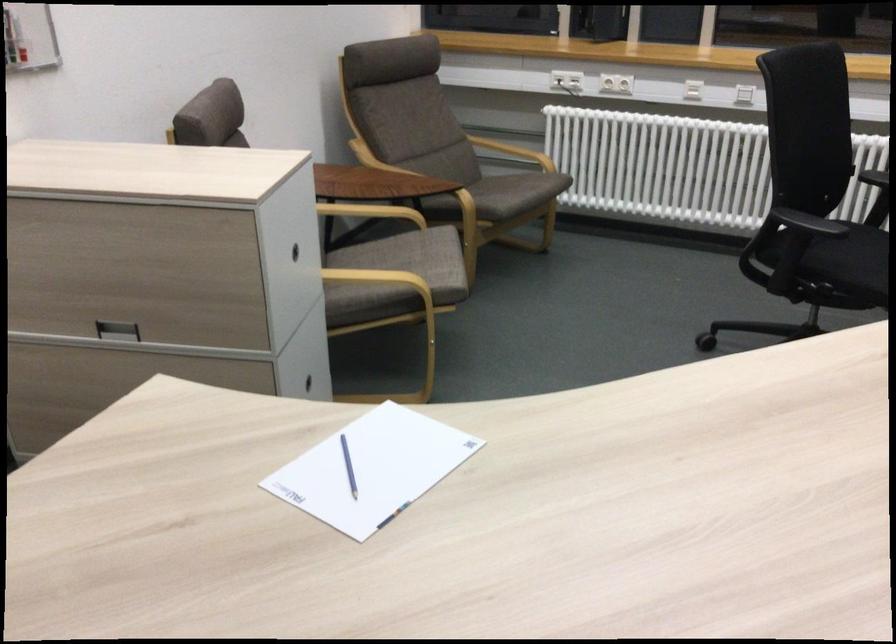
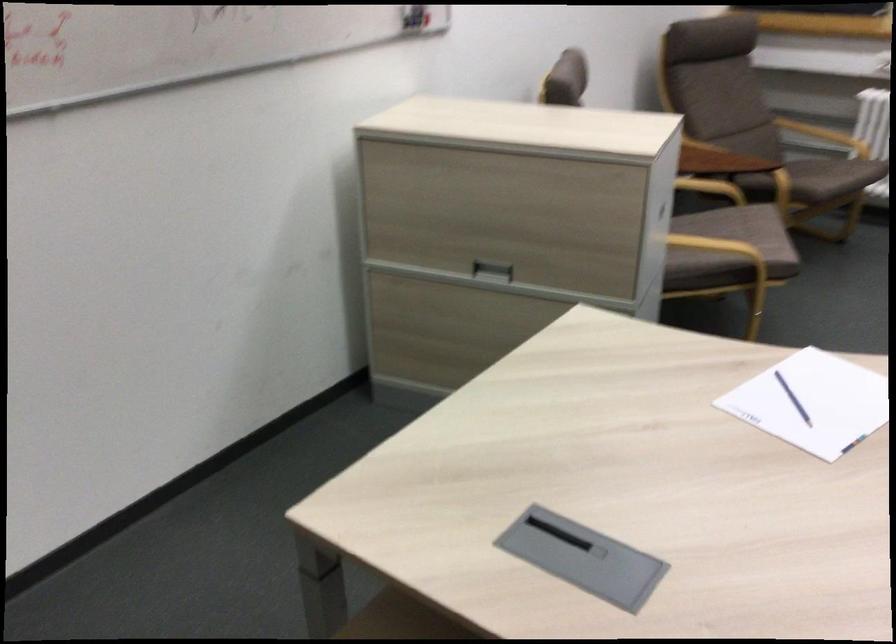
The point at (357, 460) is marked in the first image. Where is the corresponding point in the second image?

(793, 399)